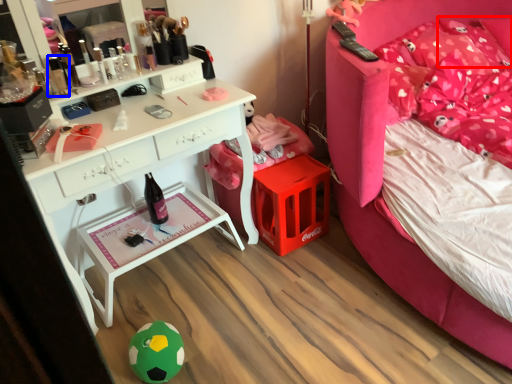
Question: Which object appears closest to the camera in this image, pillow (highlighted by a red box) or toiletry (highlighted by a blue box)?

Choices:
 (A) pillow
 (B) toiletry

Answer: (B)